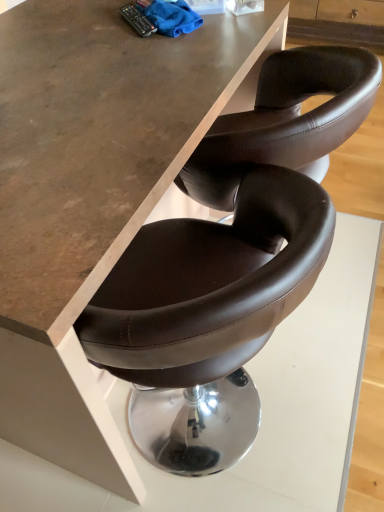
Question: In the image, is matte brown leather table at center positioned in front of or behind blue microfiber cloth at upper center?

Choices:
 (A) front
 (B) behind

Answer: (A)

Question: In terms of size, does matte brown leather table at center appear bigger or smaller than blue microfiber cloth at upper center?

Choices:
 (A) big
 (B) small

Answer: (A)

Question: Is matte brown leather table at center spatially inside blue microfiber cloth at upper center, or outside of it?

Choices:
 (A) outside
 (B) inside

Answer: (A)

Question: In terms of width, does blue microfiber cloth at upper center look wider or thinner when compared to matte brown leather table at center?

Choices:
 (A) thin
 (B) wide

Answer: (A)

Question: Is point (157, 20) closer or farther from the camera than point (1, 332)?

Choices:
 (A) farther
 (B) closer

Answer: (A)

Question: In terms of height, does blue microfiber cloth at upper center look taller or shorter compared to matte brown leather table at center?

Choices:
 (A) tall
 (B) short

Answer: (B)

Question: Visually, is blue microfiber cloth at upper center positioned to the left or to the right of matte brown leather table at center?

Choices:
 (A) left
 (B) right

Answer: (B)